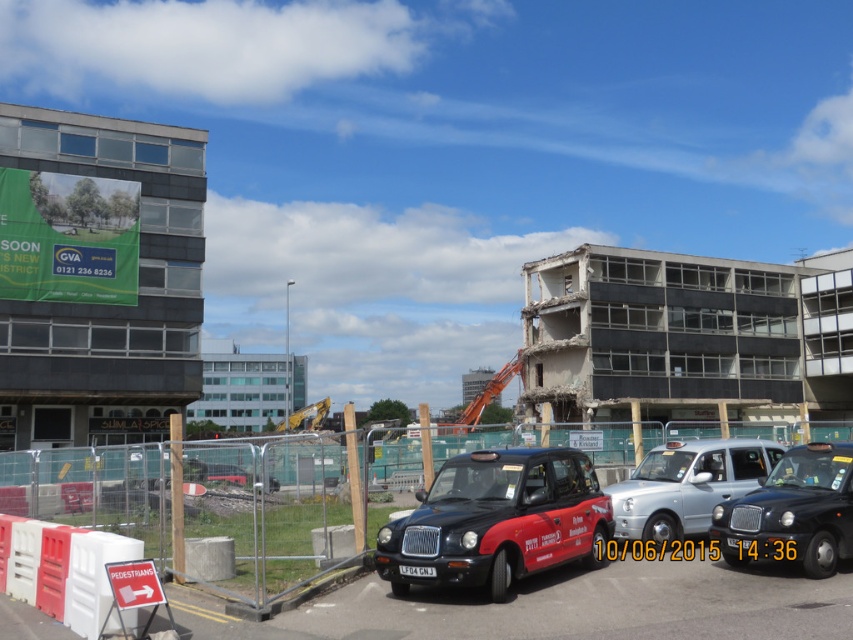
Is metallic construction crane at center bigger than black plastic license plate at center?

Indeed, metallic construction crane at center has a larger size compared to black plastic license plate at center.

Which is behind, point (503, 481) or point (434, 573)?

The point (503, 481) is more distant.

The image size is (853, 640). Find the location of `metallic construction crane at center`. metallic construction crane at center is located at coordinates (172, 509).

Who is shorter, metallic construction crane at center or black matte taxi at center?

black matte taxi at center

Does metallic construction crane at center appear under black matte taxi at center?

Indeed, metallic construction crane at center is positioned under black matte taxi at center.

Is point (78, 509) farther from camera compared to point (846, 529)?

Yes.

Identify the location of metallic construction crane at center. The width and height of the screenshot is (853, 640). (172, 509).

Is point (379, 556) in front of point (416, 572)?

No, it is not.

Who is taller, matte black taxi at center or black plastic license plate at center?

matte black taxi at center

Is point (503, 476) less distant than point (434, 573)?

No.

Identify the location of matte black taxi at center. The width and height of the screenshot is (853, 640). (498, 520).